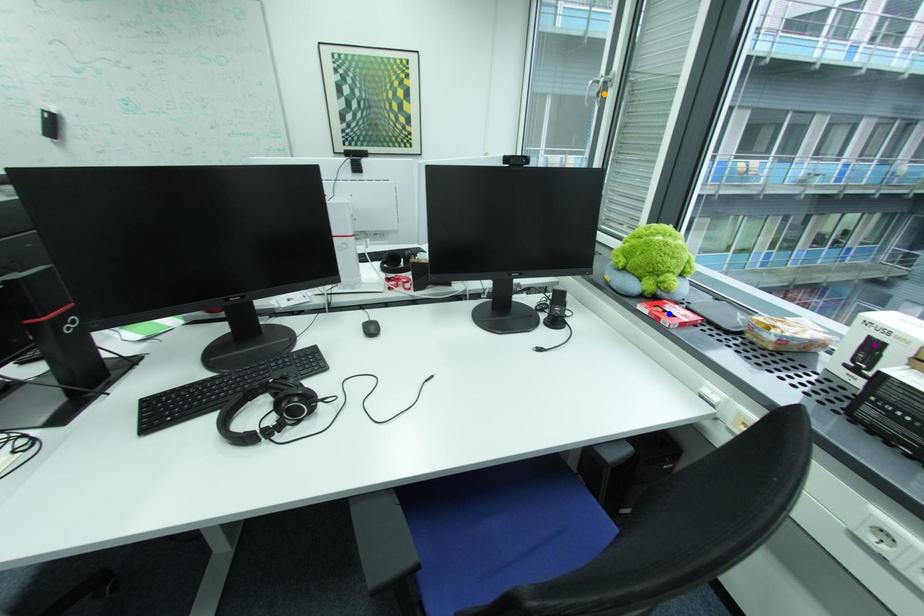
Order these from nearest to farthest:
- purple point
- orange point
- blue point

orange point
blue point
purple point